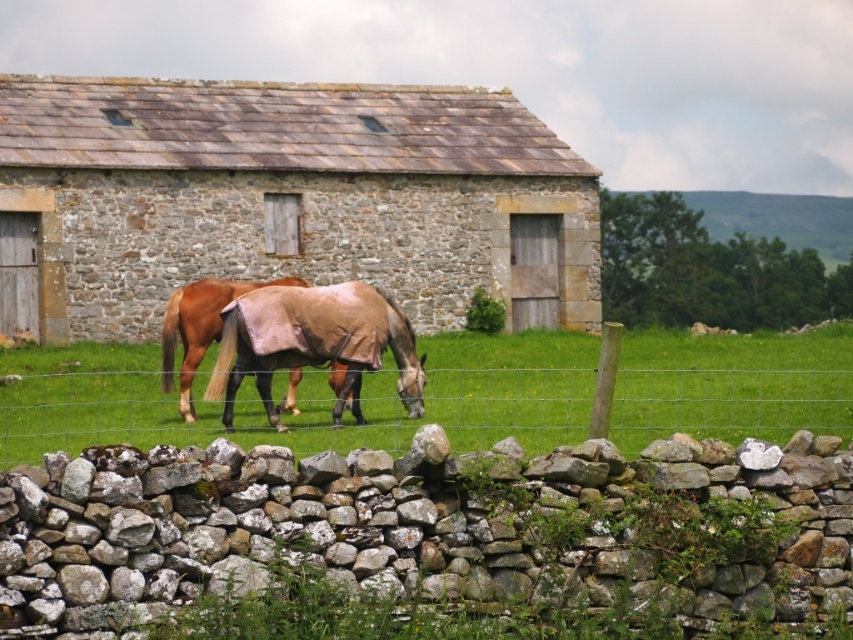
Question: Is the position of stone textured barn at center less distant than that of brown leather horse at center?

Choices:
 (A) yes
 (B) no

Answer: (B)

Question: Is stone textured barn at center below green grass at center?

Choices:
 (A) no
 (B) yes

Answer: (A)

Question: Which of the following is the farthest from the observer?

Choices:
 (A) (824, 371)
 (B) (364, 328)

Answer: (A)

Question: Among these objects, which one is nearest to the camera?

Choices:
 (A) brown leather horse at center
 (B) stone textured barn at center

Answer: (A)

Question: Where is stone textured barn at center located in relation to brown leather horse at center in the image?

Choices:
 (A) right
 (B) left

Answer: (B)

Question: Among these objects, which one is nearest to the camera?

Choices:
 (A) green grass at center
 (B) brown leather horse at center

Answer: (A)